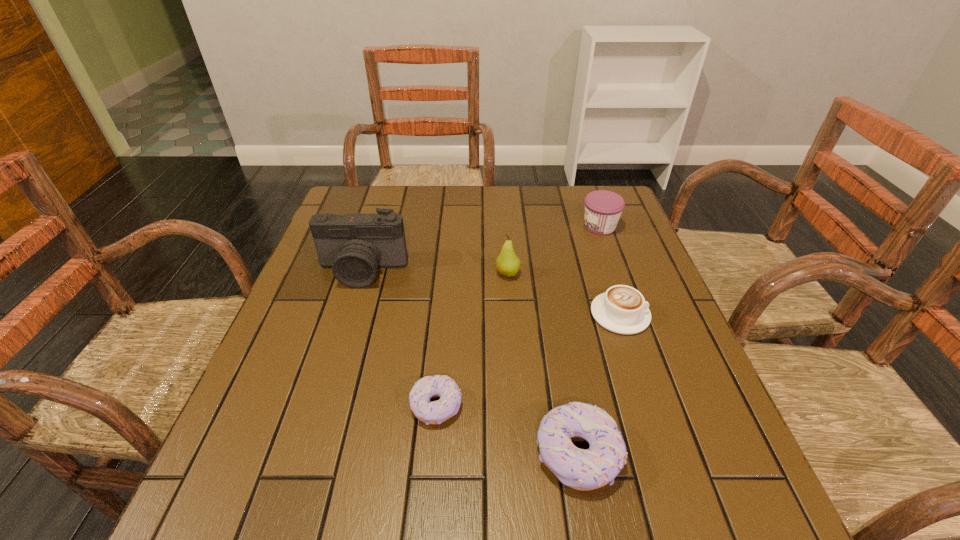
Identify the location of vacant place for an extra doughnut on the left. This screenshot has width=960, height=540. (317, 366).